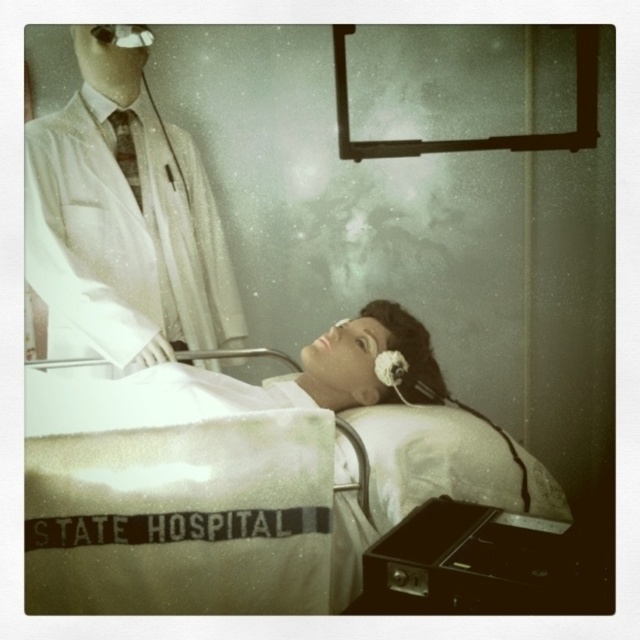
Does point (109, 92) come behind point (83, 385)?

That is True.

Who is more distant from viewer, (54, 216) or (180, 385)?

The point (54, 216) is behind.

I want to click on white matte lab coat at upper left, so click(122, 221).